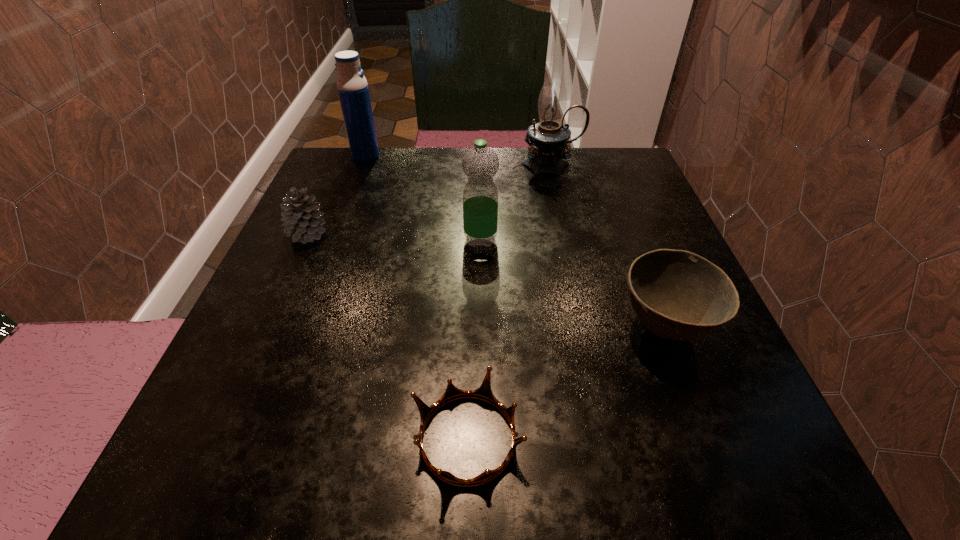
Find the location of `oil lamp`. oil lamp is located at coordinates (548, 139).

The height and width of the screenshot is (540, 960). I want to click on the farther water bottle, so click(x=352, y=86).

I want to click on the third tallest object, so click(x=480, y=163).

Where is `the nearer water bottle`? This screenshot has width=960, height=540. the nearer water bottle is located at coordinates (480, 163).

Find the location of `pinecone`. pinecone is located at coordinates (302, 221).

You are a GUI agent. You are given a task and a screenshot of the screen. Output one action in this format:
    pyautogui.click(x=<x>, y=<y>)
    Task: Click on the bowl
    
    Given the screenshot: What is the action you would take?
    pyautogui.click(x=678, y=295)

The width and height of the screenshot is (960, 540). I want to click on crown, so click(x=484, y=392).

This screenshot has width=960, height=540. What are the coordinates of `the shortest object` in the screenshot? It's located at (484, 392).

Where is `vacant space situated 0.070m on the right of the oil lamp`? The image size is (960, 540). vacant space situated 0.070m on the right of the oil lamp is located at coordinates (611, 165).

You are a GUI agent. You are given a task and a screenshot of the screen. Output one action in this format:
    pyautogui.click(x=<x>, y=<y>)
    Task: Click on the vacant space located on the front of the left water bottle
    The height and width of the screenshot is (540, 960).
    Given the screenshot: What is the action you would take?
    pyautogui.click(x=348, y=203)